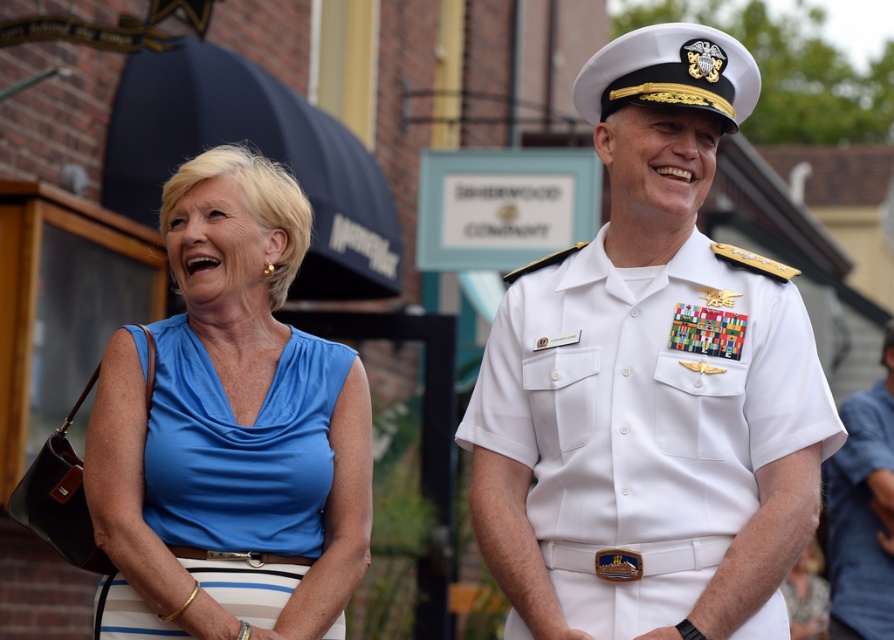
Question: Estimate the real-world distances between objects in this image. Which object is closer to the white uniform at center?

Choices:
 (A) white uniform at right
 (B) satin blue blouse at left

Answer: (B)

Question: Which point is closer to the camera?

Choices:
 (A) white uniform at center
 (B) white uniform at right
 (C) satin blue blouse at left

Answer: (B)

Question: Can you confirm if satin blue blouse at left is positioned above white uniform at right?

Choices:
 (A) yes
 (B) no

Answer: (A)

Question: Is satin blue blouse at left wider than white uniform at right?

Choices:
 (A) no
 (B) yes

Answer: (A)

Question: Estimate the real-world distances between objects in this image. Which object is farther from the white uniform at center?

Choices:
 (A) satin blue blouse at left
 (B) white uniform at right

Answer: (B)

Question: Is white uniform at center wider than white uniform at right?

Choices:
 (A) no
 (B) yes

Answer: (A)